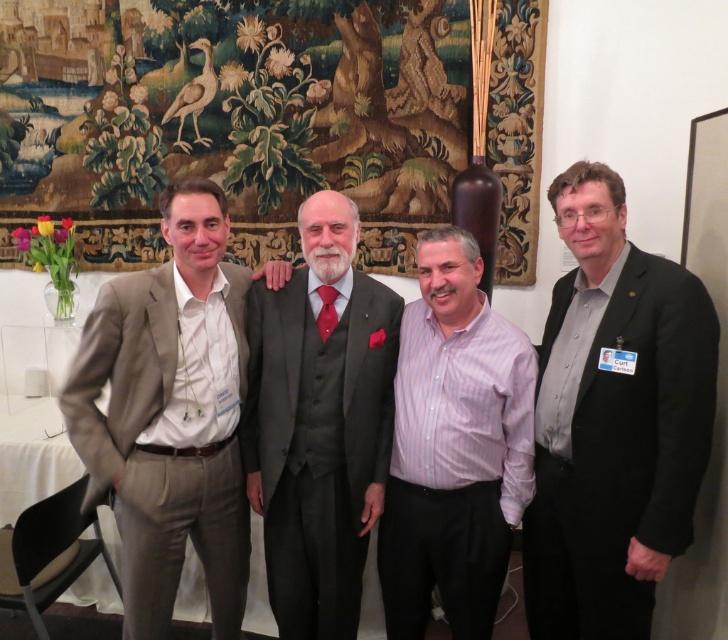
Is black matte suit at right wider than dark gray suit at center?

Incorrect, black matte suit at right's width does not surpass dark gray suit at center's.

What do you see at coordinates (613, 420) in the screenshot?
I see `black matte suit at right` at bounding box center [613, 420].

Find the location of `black matte suit at right`. black matte suit at right is located at coordinates (613, 420).

The image size is (728, 640). I want to click on black matte suit at right, so click(x=613, y=420).

Is dark gray suit at center thinner than purple striped shirt at center?

In fact, dark gray suit at center might be wider than purple striped shirt at center.

Does dark gray suit at center appear on the left side of purple striped shirt at center?

Correct, you'll find dark gray suit at center to the left of purple striped shirt at center.

Which is behind, point (273, 573) or point (456, 241)?

Positioned behind is point (273, 573).

In order to click on dark gray suit at center in this screenshot , I will do `click(320, 422)`.

Between black matte suit at right and purple striped shirt at center, which one appears on the left side from the viewer's perspective?

Positioned to the left is purple striped shirt at center.

Can you confirm if black matte suit at right is positioned above purple striped shirt at center?

Yes.

At what (x,y) coordinates should I click in order to perform the action: click on black matte suit at right. Please return your answer as a coordinate pair (x, y). The image size is (728, 640). Looking at the image, I should click on (613, 420).